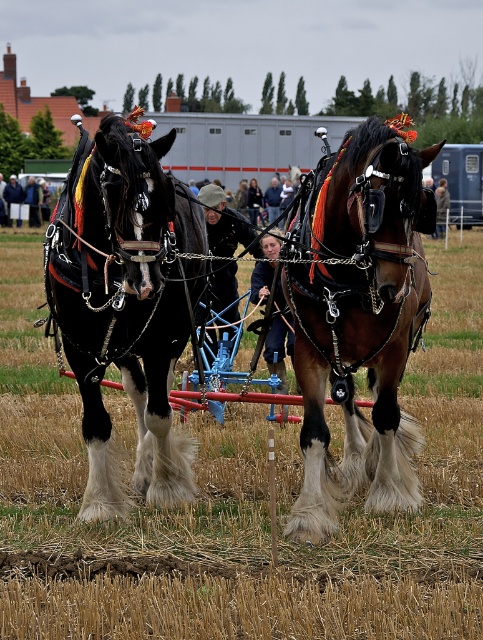
Can you confirm if black glossy horse at left is positioned below dark blue fabric at center?

No.

Between point (139, 300) and point (269, 326), which one is positioned in front?

Point (139, 300)

Locate an element on the screen. This screenshot has height=640, width=483. black glossy horse at left is located at coordinates (127, 301).

In the scene shown: Is brown fluffy hay at center to the right of dark brown leather jacket at center from the viewer's perspective?

Incorrect, brown fluffy hay at center is not on the right side of dark brown leather jacket at center.

Does brown fluffy hay at center appear under dark brown leather jacket at center?

Indeed, brown fluffy hay at center is positioned under dark brown leather jacket at center.

Who is more forward, (418, 545) or (219, 300)?

Positioned in front is point (418, 545).

Identify the location of brown fluffy hay at center. The height and width of the screenshot is (640, 483). (243, 500).

From the picture: Does dark blue fabric at center lie behind smooth blue jeans at center?

No, it is in front of smooth blue jeans at center.

Is dark blue fabric at center to the left of smooth blue jeans at center from the viewer's perspective?

In fact, dark blue fabric at center is to the right of smooth blue jeans at center.

What do you see at coordinates (280, 339) in the screenshot?
I see `dark blue fabric at center` at bounding box center [280, 339].

Image resolution: width=483 pixels, height=640 pixels. In order to click on dark blue fabric at center in this screenshot , I will do `click(280, 339)`.